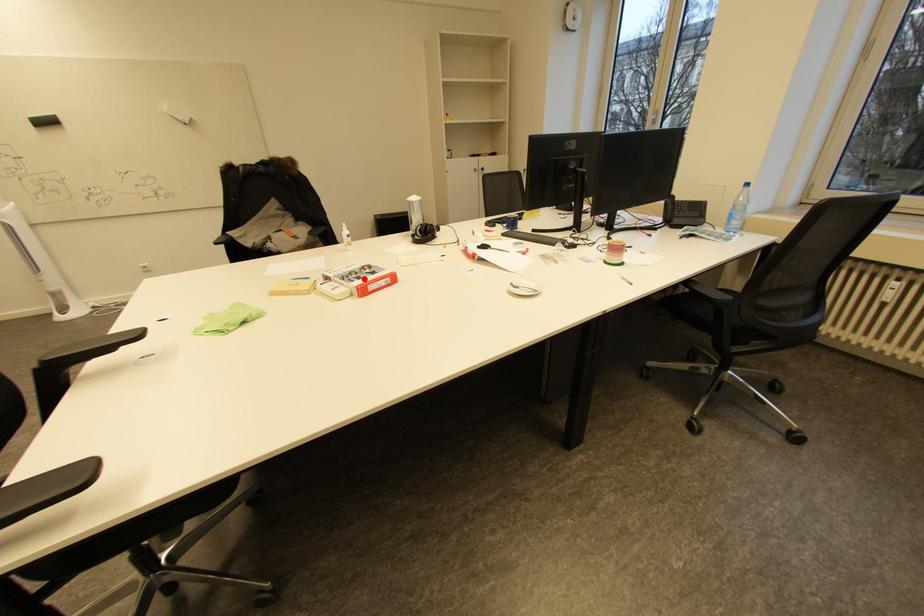
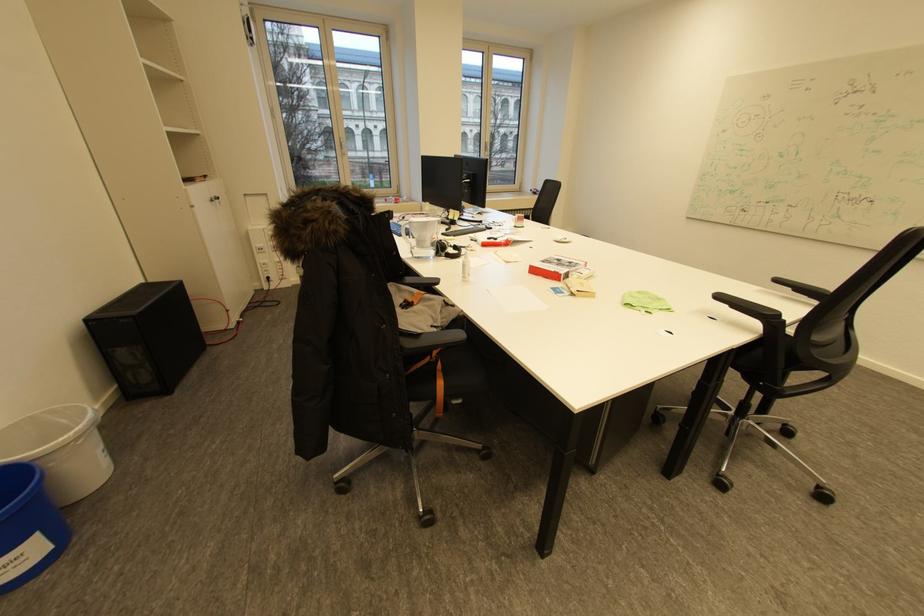
In the second image, find the point that corresponds to the highlighted location in the first image.

(576, 262)